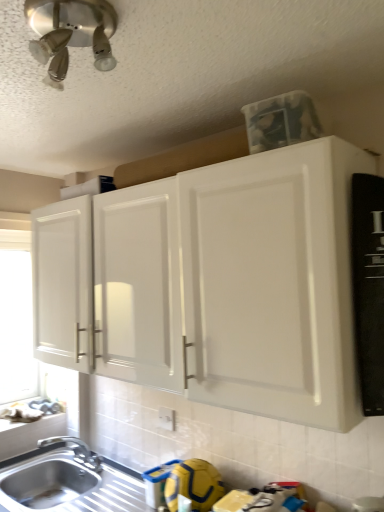
What are the coordinates of `free space to the back side of silver metallic faucet at lower left` in the screenshot? It's located at (71, 453).